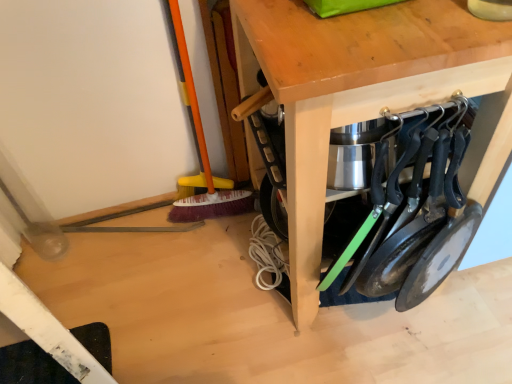
Locate an element on the screen. Image resolution: width=512 pixels, height=384 pixels. blank area beneath black matte frying pans at lower right (from a real-world perspective) is located at coordinates (389, 340).